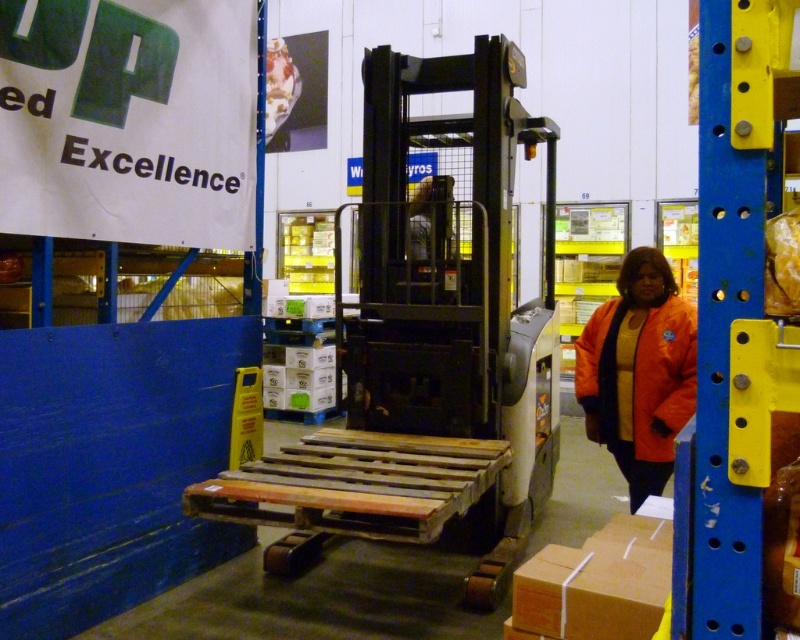
Question: Among these objects, which one is nearest to the camera?

Choices:
 (A) orange matte jacket at lower right
 (B) metallic forklift at center

Answer: (B)

Question: Can you confirm if metallic forklift at center is wider than orange matte jacket at lower right?

Choices:
 (A) no
 (B) yes

Answer: (B)

Question: Does metallic forklift at center come in front of orange matte jacket at lower right?

Choices:
 (A) yes
 (B) no

Answer: (A)

Question: Is metallic forklift at center to the left of orange matte jacket at lower right from the viewer's perspective?

Choices:
 (A) no
 (B) yes

Answer: (B)